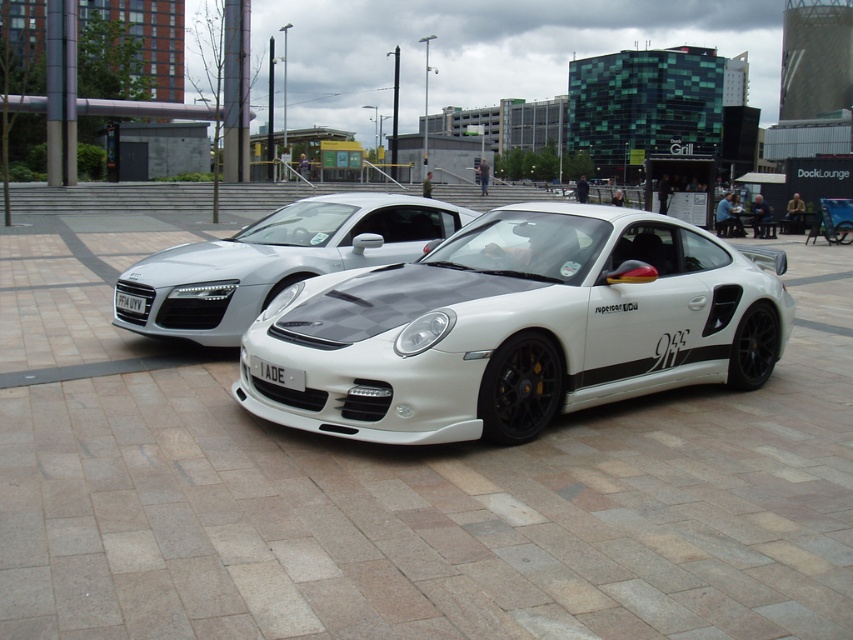
Question: Among these objects, which one is farthest from the camera?

Choices:
 (A) white matte sports car at center
 (B) white plastic license plate at center

Answer: (B)

Question: Is white matte sports car at center above white matte porsche 911 at center?

Choices:
 (A) no
 (B) yes

Answer: (B)

Question: Is white matte porsche 911 at center below white plastic license plate at center?

Choices:
 (A) no
 (B) yes

Answer: (B)

Question: Which of these objects is positioned closest to the white matte sports car at center?

Choices:
 (A) white plastic license plate at center
 (B) white matte porsche 911 at center

Answer: (B)

Question: Is white matte porsche 911 at center below white plastic license plate at center?

Choices:
 (A) no
 (B) yes

Answer: (B)

Question: Estimate the real-world distances between objects in this image. Which object is closer to the white matte porsche 911 at center?

Choices:
 (A) white plastic license plate at center
 (B) white matte sports car at center

Answer: (A)